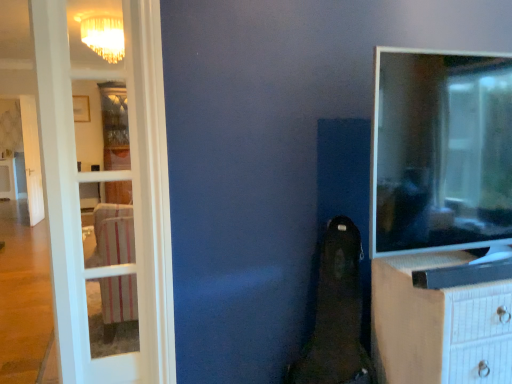
Question: From the image's perspective, is white textured chest of drawers at right below white glass door at left?

Choices:
 (A) no
 (B) yes

Answer: (B)

Question: Does white textured chest of drawers at right have a lesser width compared to white glass door at left?

Choices:
 (A) no
 (B) yes

Answer: (A)

Question: Is white textured chest of drawers at right to the right of white glass door at left from the viewer's perspective?

Choices:
 (A) yes
 (B) no

Answer: (A)

Question: From a real-world perspective, is white textured chest of drawers at right on top of white glass door at left?

Choices:
 (A) no
 (B) yes

Answer: (A)

Question: Does white textured chest of drawers at right have a lesser height compared to white glass door at left?

Choices:
 (A) yes
 (B) no

Answer: (A)

Question: Looking at the image, does matte black tv at right seem bigger or smaller compared to white glass door at left?

Choices:
 (A) big
 (B) small

Answer: (B)

Question: Is matte black tv at right wider or thinner than white glass door at left?

Choices:
 (A) thin
 (B) wide

Answer: (A)

Question: Is point (489, 125) positioned closer to the camera than point (153, 135)?

Choices:
 (A) closer
 (B) farther

Answer: (A)

Question: From their relative heights in the image, would you say matte black tv at right is taller or shorter than white glass door at left?

Choices:
 (A) tall
 (B) short

Answer: (B)

Question: From a real-world perspective, is matte black tv at right above or below white textured chest of drawers at right?

Choices:
 (A) above
 (B) below

Answer: (A)

Question: Considering the positions of matte black tv at right and white textured chest of drawers at right in the image, is matte black tv at right bigger or smaller than white textured chest of drawers at right?

Choices:
 (A) big
 (B) small

Answer: (B)

Question: Is matte black tv at right taller or shorter than white textured chest of drawers at right?

Choices:
 (A) tall
 (B) short

Answer: (B)

Question: In the image, is matte black tv at right on the left side or the right side of white textured chest of drawers at right?

Choices:
 (A) right
 (B) left

Answer: (B)

Question: Based on their positions, is white glass door at left located to the left or right of white textured chest of drawers at right?

Choices:
 (A) left
 (B) right

Answer: (A)

Question: From the image's perspective, is white glass door at left above or below white textured chest of drawers at right?

Choices:
 (A) below
 (B) above

Answer: (B)